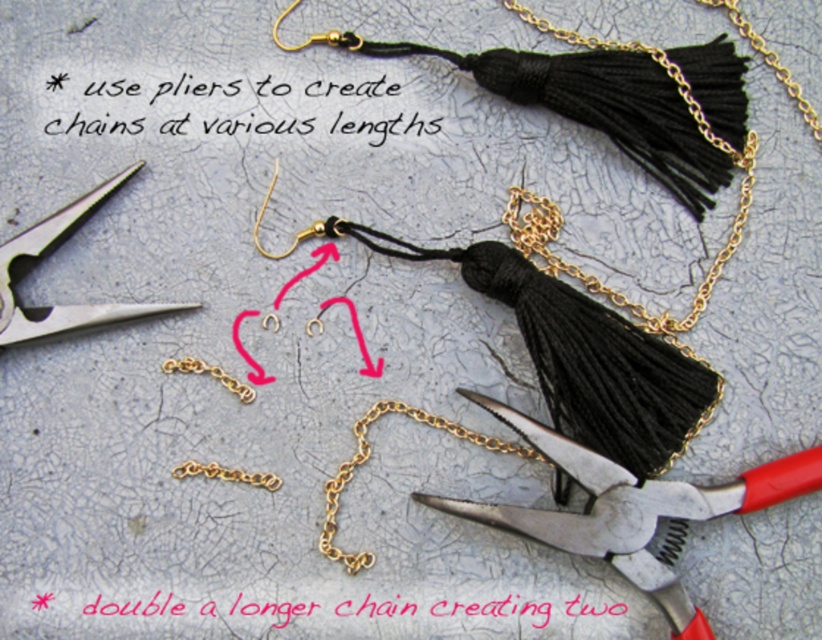
You are an artist working on a jewelry project and need to place a pink paper at center. Where should you place it in terms of coordinates?

The pink paper at center should be placed at coordinates point (446, 609).

From the picture: You are looking at the crafting setup for tassel earrings. There are two points marked in the image. The first point is at coordinates point (377, 83) and the second point is at point (606, 612). From your perspective, which point is closer to you?

Point (606, 612) is closer to you because point (377, 83) is behind it.

You are a jeweler working on the crafting setup. You need to place a new earring component on top of the pink paper at center. However, there is a gold chain at center in the way. Which object should you move to make space?

You should move the gold chain at center because the pink paper at center is closer to the viewer, meaning the gold chain is behind it and can be moved out of the way without disturbing the paper.